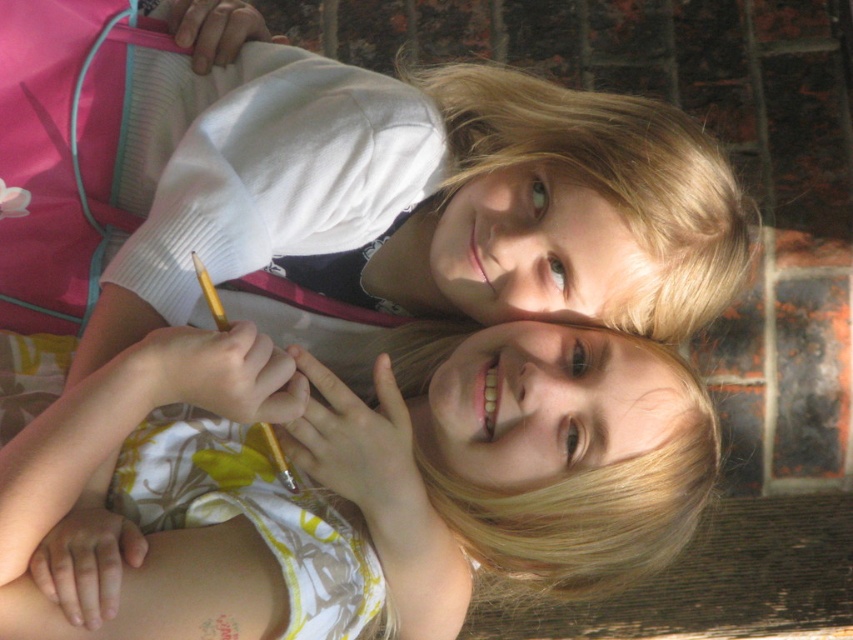
Consider the image. You are a photographer setting up a photo shoot for two children wearing the white floral dress at center and the matte white shirt at upper center. You want to ensure both outfits are visible in the final shot. Based on their heights, which child should you position closer to the front to avoid one blocking the other?

The white floral dress at center has a lesser height compared to matte white shirt at upper center. Therefore, the child wearing the white floral dress at center should be positioned closer to the front to ensure both are visible without one blocking the other.

You are a photographer trying to capture a closeup of the white floral dress at center and the matte white shirt at upper center. Since the brick wall is behind them, which object should you focus on to ensure both are in sharp focus?

Both the white floral dress at center and the matte white shirt at upper center are positioned on the same plane relative to the brick wall background, so focusing on either will keep both in sharp focus.

You are a photographer trying to capture a closeup shot of both the white floral dress at center and the matte white shirt at upper center. Given that your camera lens can focus on objects within a 6 inch range, will you be able to capture both subjects in focus without adjusting your focus distance?

The distance between the white floral dress at center and the matte white shirt at upper center is 7.16 inches. Since this exceeds the 6 inch range your camera lens can focus on, you will need to adjust your focus distance to ensure both are in focus.